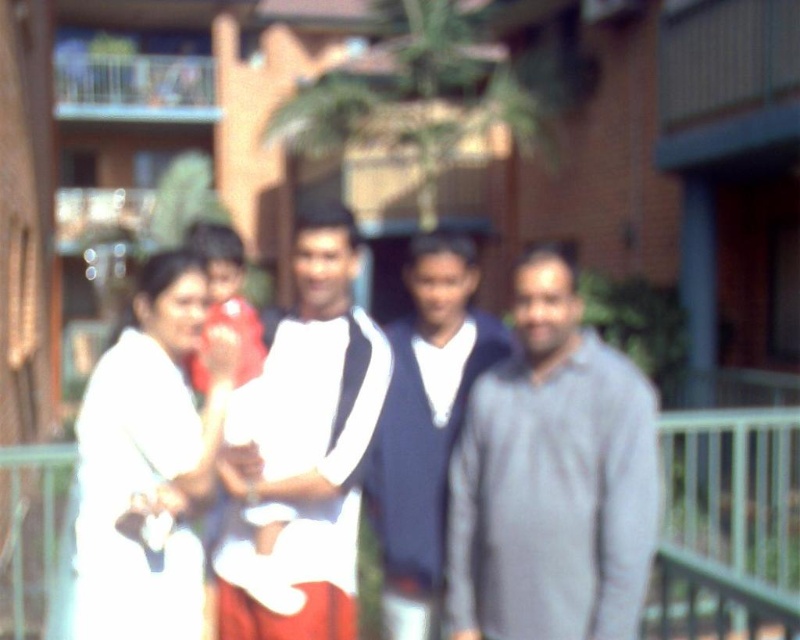
Where is `white matte shirt at left`? The height and width of the screenshot is (640, 800). white matte shirt at left is located at coordinates (148, 461).

Which is behind, point (172, 534) or point (449, 298)?

Point (449, 298)

Locate an element on the screen. white matte shirt at left is located at coordinates (148, 461).

I want to click on white matte shirt at left, so click(x=148, y=461).

Which of these two, white fabric shirt at center or white matte shirt at center, stands shorter?

Standing shorter between the two is white fabric shirt at center.

Does white fabric shirt at center appear over white matte shirt at center?

No, white fabric shirt at center is not above white matte shirt at center.

Does point (250, 493) come closer to viewer compared to point (224, 307)?

Yes, it is.

Identify the location of white fabric shirt at center. pyautogui.click(x=304, y=448).

Is gray matte shirt at center further to camera compared to white matte shirt at center?

No, gray matte shirt at center is in front of white matte shirt at center.

The image size is (800, 640). Describe the element at coordinates (552, 480) in the screenshot. I see `gray matte shirt at center` at that location.

I want to click on gray matte shirt at center, so click(552, 480).